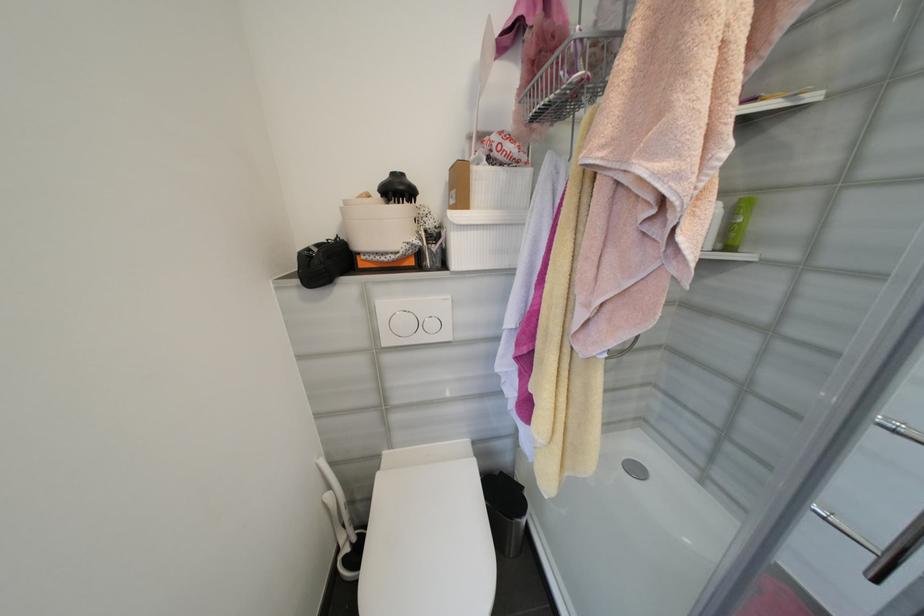
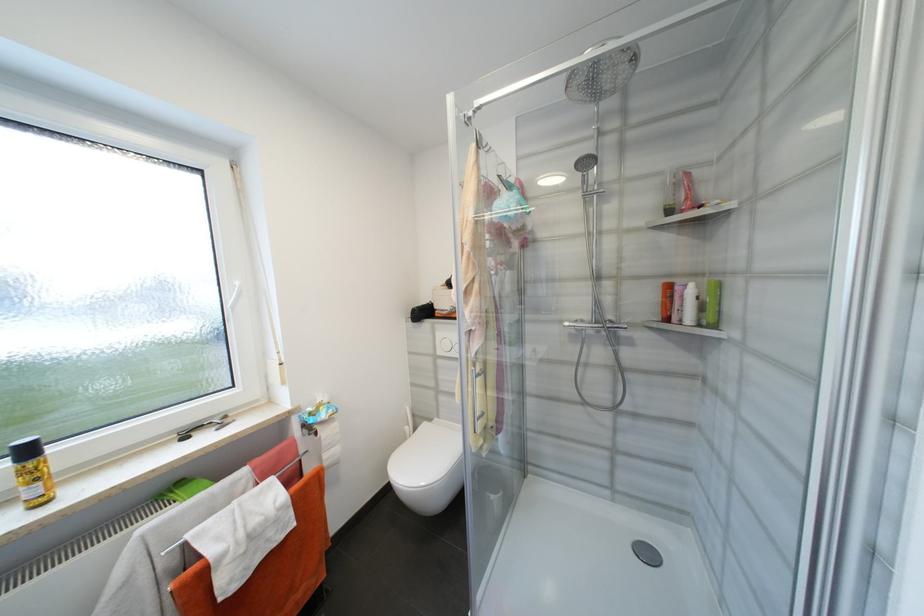
Find the pixel in the second image that matches (369,344) in the first image.

(436, 352)